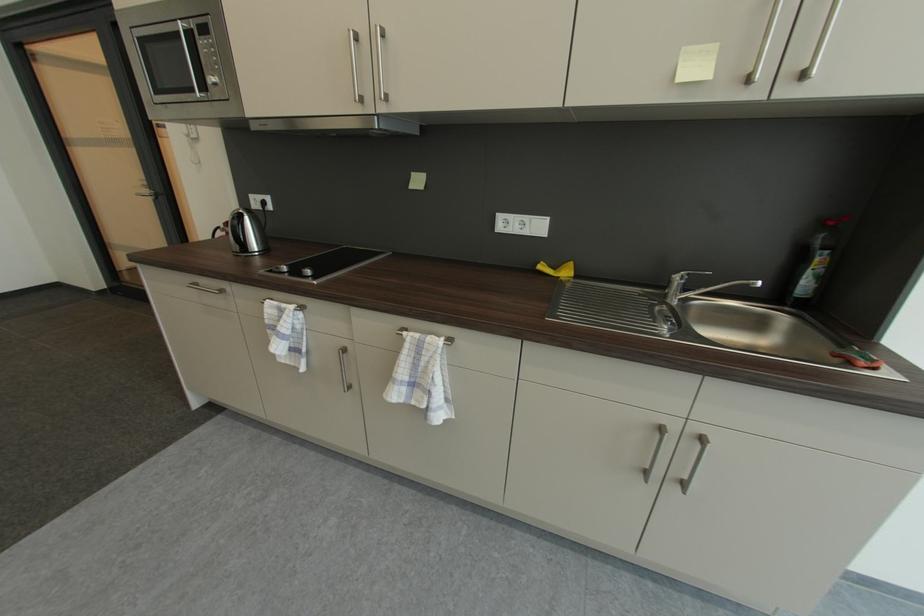
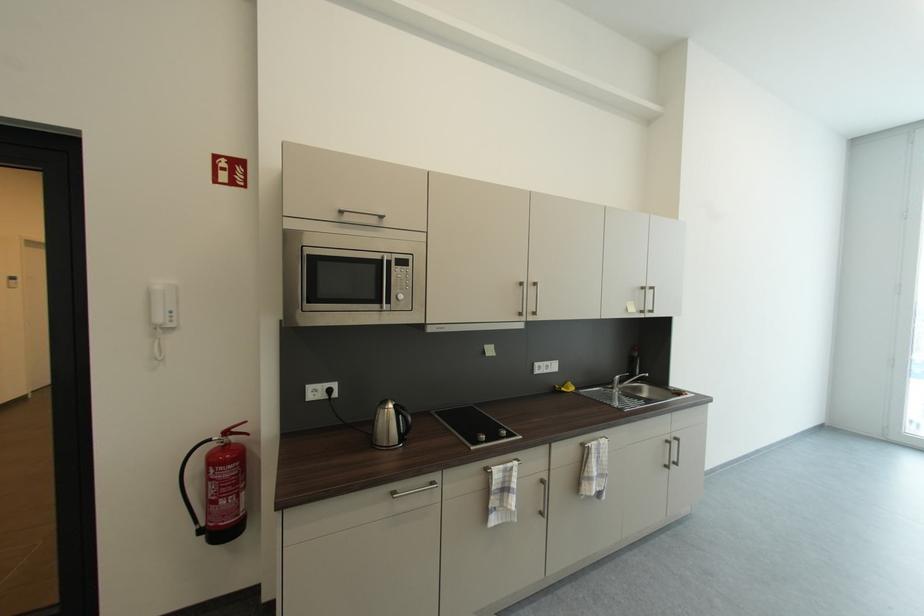
Find the pixel in the second image that matches (203,26) in the first image.

(403, 261)